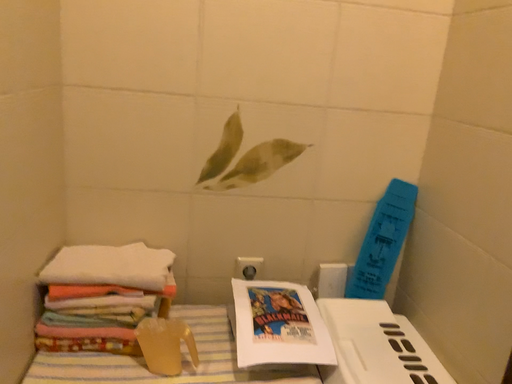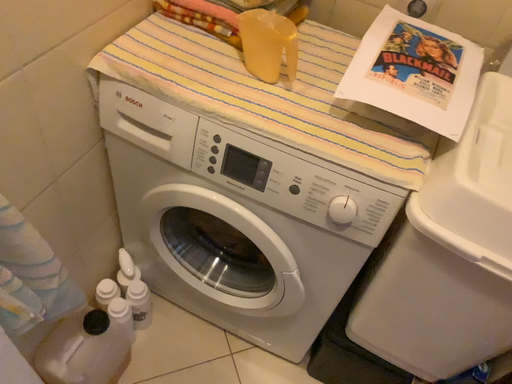
Question: Which way did the camera rotate in the video?

Choices:
 (A) rotated right
 (B) rotated left

Answer: (B)